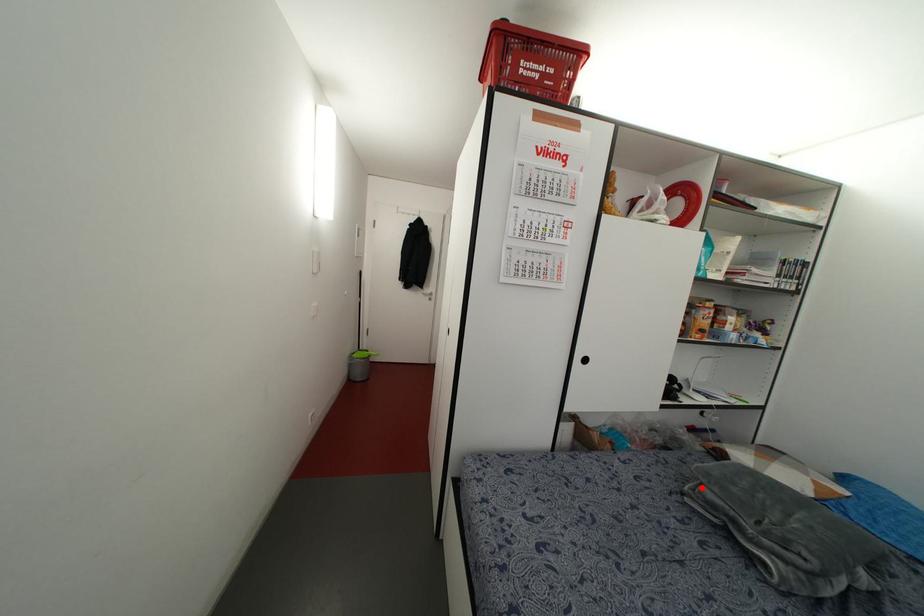
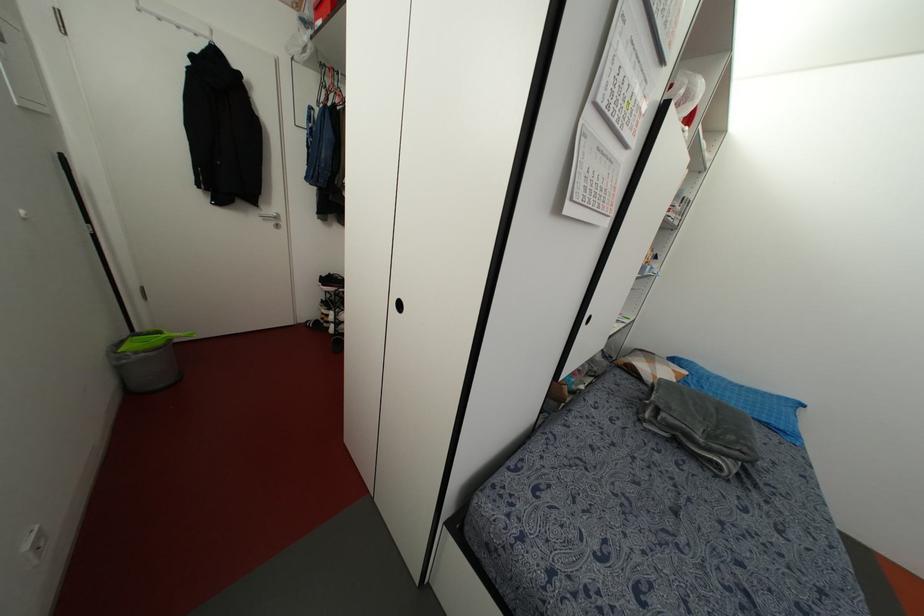
Question: I am providing you with two images of the same scene from different viewpoints. A red point is marked on the first image. At the location where the point appears in image 1, is it still visible in image 2?

Choices:
 (A) Yes
 (B) No

Answer: (A)